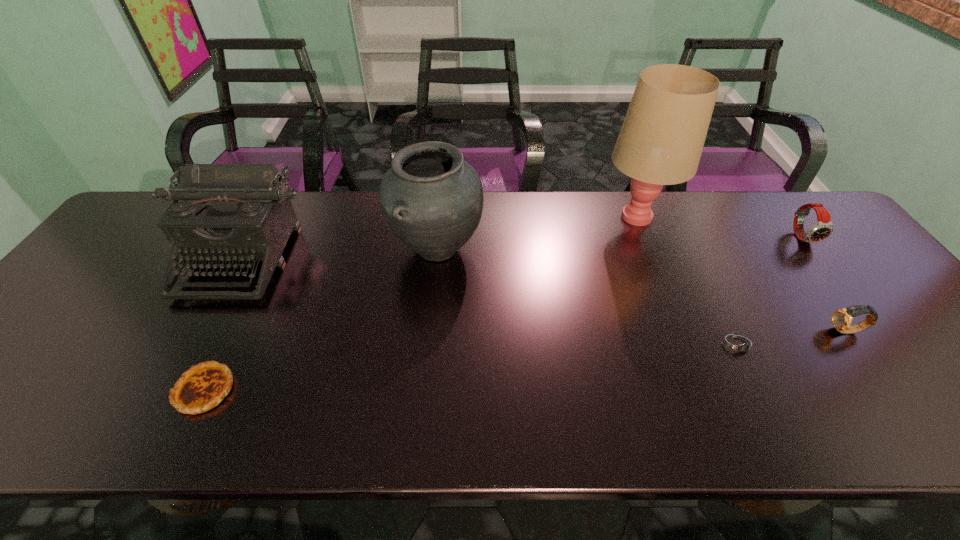
The width and height of the screenshot is (960, 540). What are the coordinates of `urn that is positioned at the far edge` in the screenshot? It's located at (432, 199).

At what (x,y) coordinates should I click in order to perform the action: click on typewriter present at the far edge. Please return your answer as a coordinate pair (x, y). The height and width of the screenshot is (540, 960). Looking at the image, I should click on (226, 212).

The width and height of the screenshot is (960, 540). Find the location of `watch that is positioned at the far edge`. watch that is positioned at the far edge is located at coordinates (823, 228).

This screenshot has height=540, width=960. I want to click on object situated at the near edge, so click(x=202, y=387).

The height and width of the screenshot is (540, 960). In order to click on object positioned at the far right corner in this screenshot , I will do `click(823, 228)`.

Where is `blank space at the far edge`? blank space at the far edge is located at coordinates coord(576,219).

In order to click on vacant area at the near edge of the desktop in this screenshot , I will do `click(93, 442)`.

Image resolution: width=960 pixels, height=540 pixels. Find the location of `vacant region at the far left corner of the desktop`. vacant region at the far left corner of the desktop is located at coordinates (158, 216).

You are a GUI agent. You are given a task and a screenshot of the screen. Output one action in this format:
    pyautogui.click(x=<x>, y=<y>)
    Task: Click on the free region at the far right corner
    
    Given the screenshot: What is the action you would take?
    pyautogui.click(x=807, y=227)

Find the location of `vacant space in between the fifth object from right to left and the tallest object`. vacant space in between the fifth object from right to left and the tallest object is located at coordinates (537, 232).